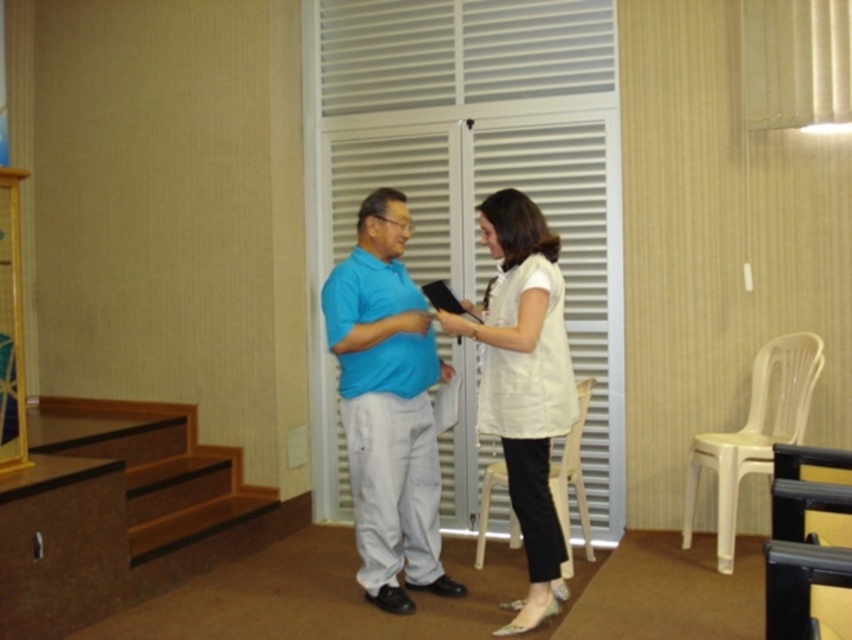
Is white plastic chair at right positioned before white plastic chair at center?

That is False.

Is point (790, 340) behind point (565, 468)?

No, it is not.

You are a GUI agent. You are given a task and a screenshot of the screen. Output one action in this format:
    pyautogui.click(x=<x>, y=<y>)
    Task: Click on the white plastic chair at right
    The width and height of the screenshot is (852, 640).
    Given the screenshot: What is the action you would take?
    pyautogui.click(x=753, y=433)

Is matte blue shirt at center behind white plastic chair at center?

Yes, it is behind white plastic chair at center.

Is point (373, 378) positioned in front of point (562, 464)?

Yes.

I want to click on matte blue shirt at center, so click(x=389, y=406).

Which is above, white fabric dress at center or white plastic chair at center?

white fabric dress at center is above.

Who is more forward, (x=519, y=472) or (x=475, y=561)?

Point (x=519, y=472) is more forward.

Find the location of a particular element. The height and width of the screenshot is (640, 852). white fabric dress at center is located at coordinates (522, 384).